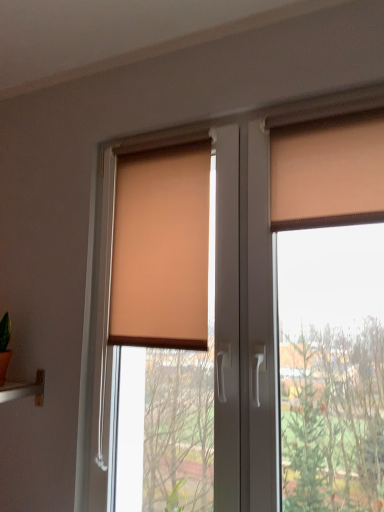
Question: Considering the relative sizes of matte orange roller blind at center and matte orange curtain at upper right in the image provided, is matte orange roller blind at center taller than matte orange curtain at upper right?

Choices:
 (A) yes
 (B) no

Answer: (A)

Question: Considering the relative positions of matte orange roller blind at center and matte orange curtain at upper right in the image provided, is matte orange roller blind at center to the left of matte orange curtain at upper right from the viewer's perspective?

Choices:
 (A) yes
 (B) no

Answer: (A)

Question: From a real-world perspective, is matte orange roller blind at center below matte orange curtain at upper right?

Choices:
 (A) no
 (B) yes

Answer: (B)

Question: Is matte orange roller blind at center behind matte orange curtain at upper right?

Choices:
 (A) yes
 (B) no

Answer: (B)

Question: Considering the relative sizes of matte orange roller blind at center and matte orange curtain at upper right in the image provided, is matte orange roller blind at center wider than matte orange curtain at upper right?

Choices:
 (A) no
 (B) yes

Answer: (B)

Question: Can you confirm if matte orange roller blind at center is smaller than matte orange curtain at upper right?

Choices:
 (A) yes
 (B) no

Answer: (B)

Question: Does matte orange curtain at upper right appear on the left side of matte orange roller blind at center?

Choices:
 (A) no
 (B) yes

Answer: (A)

Question: Considering the relative sizes of matte orange curtain at upper right and matte orange roller blind at center in the image provided, is matte orange curtain at upper right thinner than matte orange roller blind at center?

Choices:
 (A) yes
 (B) no

Answer: (A)

Question: From a real-world perspective, is matte orange curtain at upper right on matte orange roller blind at center?

Choices:
 (A) yes
 (B) no

Answer: (A)

Question: Is the position of matte orange curtain at upper right less distant than that of matte orange roller blind at center?

Choices:
 (A) yes
 (B) no

Answer: (B)

Question: Does matte orange curtain at upper right have a greater height compared to matte orange roller blind at center?

Choices:
 (A) yes
 (B) no

Answer: (B)

Question: Is matte orange curtain at upper right positioned beyond the bounds of matte orange roller blind at center?

Choices:
 (A) no
 (B) yes

Answer: (A)

Question: Considering the relative positions of matte orange roller blind at center and beige fabric blind at center in the image provided, is matte orange roller blind at center to the left of beige fabric blind at center from the viewer's perspective?

Choices:
 (A) no
 (B) yes

Answer: (A)